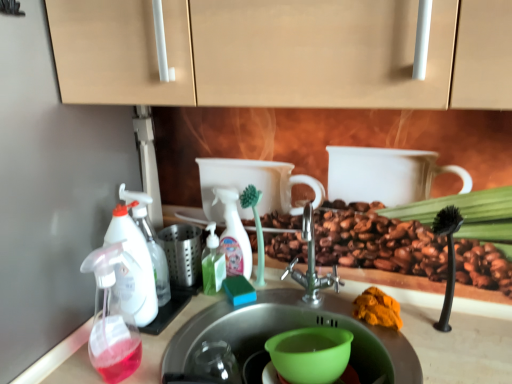
Find the location of a particular element. Image resolution: width=512 pixels, height=384 pixels. vacant space to the right of green translucent soap dispenser at center, which appears as the third soap dispenser when viewed from the front is located at coordinates (287, 300).